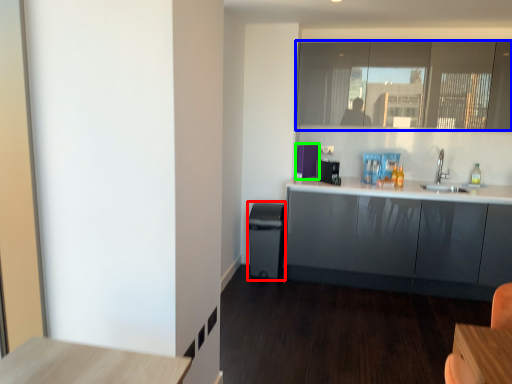
Question: Based on their relative distances, which object is farther from dish washer (highlighted by a red box)? Choose from window (highlighted by a blue box) and appliance (highlighted by a green box).

Choices:
 (A) window
 (B) appliance

Answer: (A)